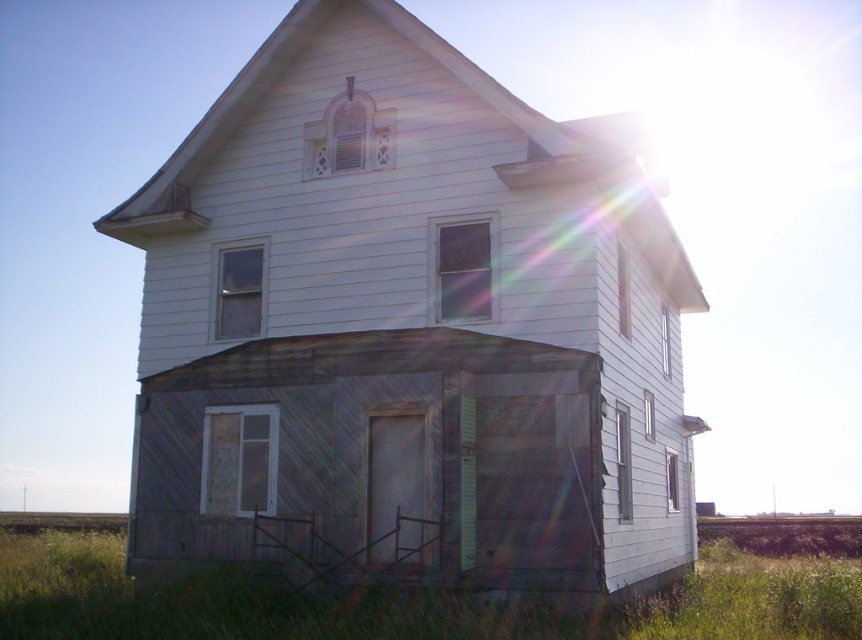
Question: Is white wooden house at center positioned at the back of green grass at lower center?

Choices:
 (A) no
 (B) yes

Answer: (B)

Question: Can you confirm if white wooden house at center is bigger than green grass at lower center?

Choices:
 (A) no
 (B) yes

Answer: (A)

Question: Which of the following is the farthest from the observer?

Choices:
 (A) green grass at lower center
 (B) white wooden house at center

Answer: (B)

Question: Does white wooden house at center appear on the left side of green grass at lower center?

Choices:
 (A) yes
 (B) no

Answer: (B)

Question: Which object appears closest to the camera in this image?

Choices:
 (A) green grass at lower center
 (B) white wooden house at center

Answer: (A)